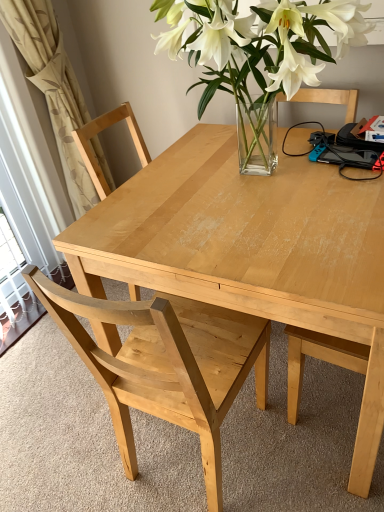
Question: From the image's perspective, is beige fabric curtain at left located above light wood chair at center?

Choices:
 (A) no
 (B) yes

Answer: (B)

Question: Does beige fabric curtain at left have a lesser height compared to light wood chair at center?

Choices:
 (A) no
 (B) yes

Answer: (A)

Question: Is beige fabric curtain at left bigger than light wood chair at center?

Choices:
 (A) no
 (B) yes

Answer: (A)

Question: Is beige fabric curtain at left oriented towards light wood chair at center?

Choices:
 (A) yes
 (B) no

Answer: (B)

Question: Is beige fabric curtain at left further to the viewer compared to light wood chair at center?

Choices:
 (A) no
 (B) yes

Answer: (B)

Question: From the image's perspective, is beige fabric curtain at left under light wood chair at center?

Choices:
 (A) no
 (B) yes

Answer: (A)

Question: Is beige fabric curtain at left bigger than natural wood table at center?

Choices:
 (A) no
 (B) yes

Answer: (A)

Question: From the image's perspective, is beige fabric curtain at left above natural wood table at center?

Choices:
 (A) no
 (B) yes

Answer: (B)

Question: Does beige fabric curtain at left turn towards natural wood table at center?

Choices:
 (A) yes
 (B) no

Answer: (A)

Question: Is beige fabric curtain at left turned away from natural wood table at center?

Choices:
 (A) yes
 (B) no

Answer: (B)

Question: Does beige fabric curtain at left appear on the right side of natural wood table at center?

Choices:
 (A) yes
 (B) no

Answer: (B)

Question: Does beige fabric curtain at left have a greater height compared to natural wood table at center?

Choices:
 (A) yes
 (B) no

Answer: (A)

Question: From a real-world perspective, does natural wood table at center stand above beige fabric curtain at left?

Choices:
 (A) no
 (B) yes

Answer: (A)